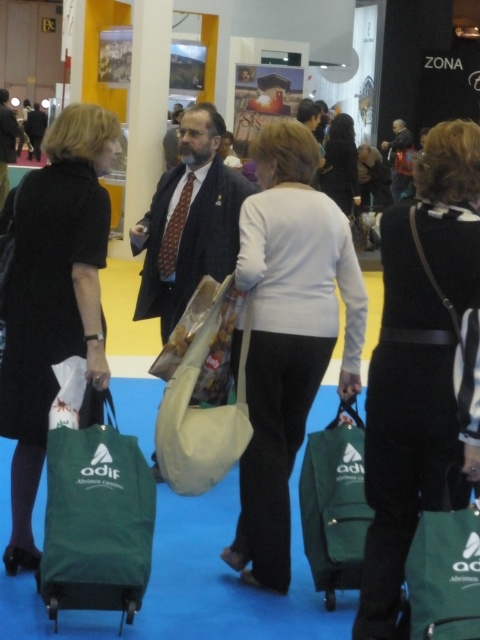
You are standing at the entrance of the exhibition hall and want to find the black matte bag at center. According to the coordinates provided, where should you look relative to the entrance?

The black matte bag at center is located at coordinates 0.573 on the x axis and 0.875 on the y axis relative to the entrance.